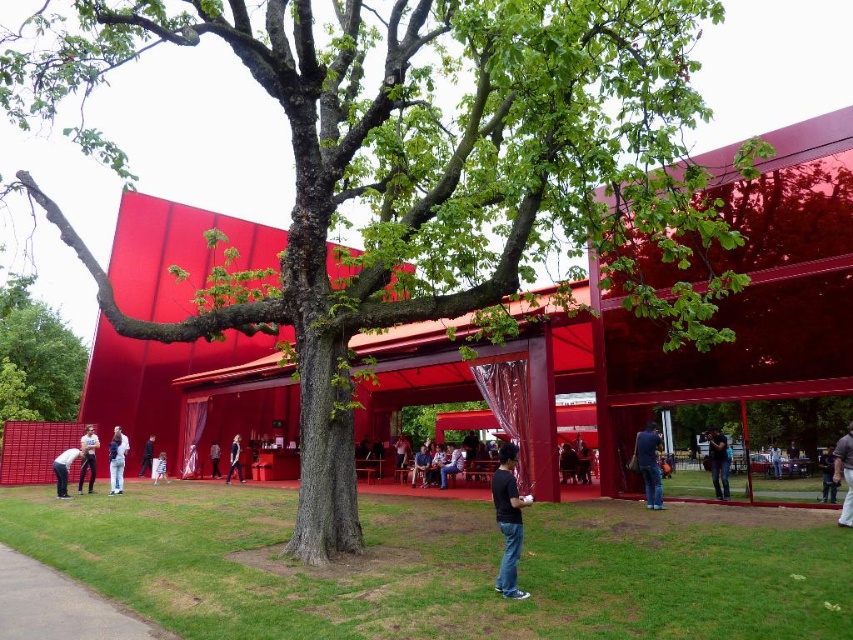
Question: Among these objects, which one is farthest from the camera?

Choices:
 (A) dark blue jeans at lower left
 (B) dark blue shirt at lower right
 (C) light blue denim jeans at center

Answer: (C)

Question: Which of the following is the closest to the observer?

Choices:
 (A) black cotton shirt at center
 (B) dark gray fabric at lower right
 (C) denim jeans at center

Answer: (B)

Question: Is denim jacket at lower center behind light blue denim jeans at center?

Choices:
 (A) yes
 (B) no

Answer: (B)

Question: Which object is closer to the camera taking this photo?

Choices:
 (A) black cotton shirt at center
 (B) dark blue jeans at lower center

Answer: (A)

Question: Does dark blue shirt at lower right come behind denim jeans at center?

Choices:
 (A) no
 (B) yes

Answer: (A)

Question: Is dark gray fabric at lower right further to camera compared to denim jacket at lower center?

Choices:
 (A) yes
 (B) no

Answer: (B)